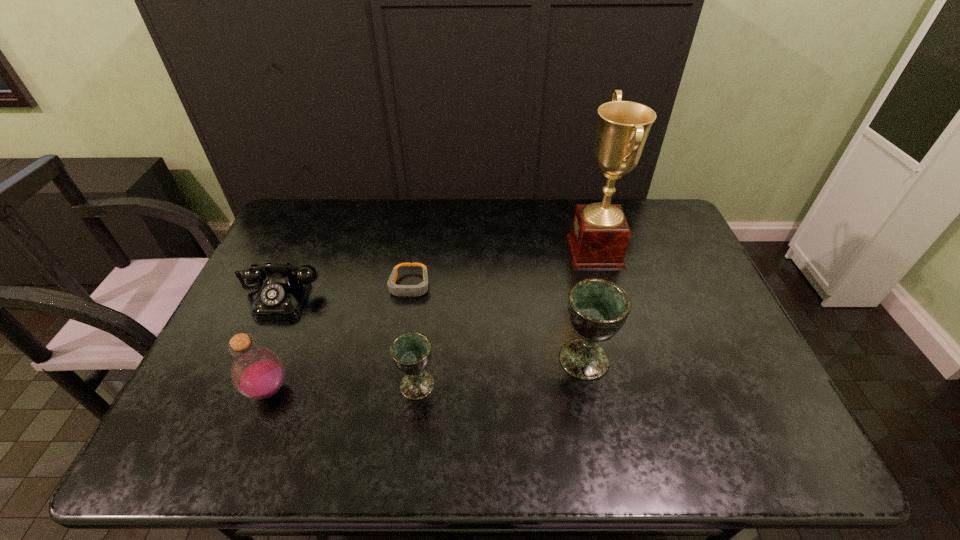
Locate an element on the screen. Image resolution: width=960 pixels, height=540 pixels. vacant position in the image that satisfies the following two spatial constraints: 1. on the dial of the bottle; 2. on the left side of the fifth tallest object is located at coordinates (239, 390).

Locate an element on the screen. The width and height of the screenshot is (960, 540). free location that satisfies the following two spatial constraints: 1. on the plaque of the trophy cup; 2. on the dial of the second shortest object is located at coordinates (608, 296).

I want to click on vacant space that satisfies the following two spatial constraints: 1. on the dial of the fourth shortest object; 2. on the right side of the fifth tallest object, so click(x=239, y=390).